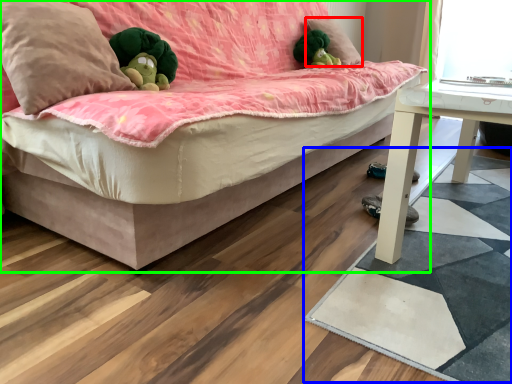
Question: Estimate the real-world distances between objects in this image. Which object is farther from pillow (highlighted by a red box), mat (highlighted by a blue box) or studio couch (highlighted by a green box)?

Choices:
 (A) mat
 (B) studio couch

Answer: (A)